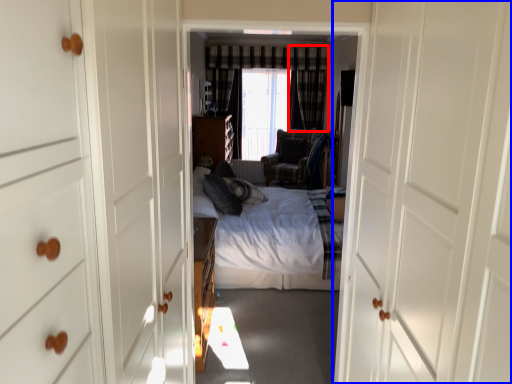
Question: Which object appears closest to the camera in this image, curtain (highlighted by a red box) or door (highlighted by a blue box)?

Choices:
 (A) curtain
 (B) door

Answer: (B)